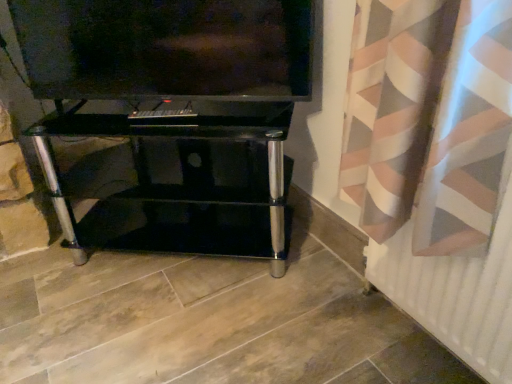
Question: Is black glass tv stand at center in front of white matte radiator at lower right?

Choices:
 (A) no
 (B) yes

Answer: (A)

Question: Does black glass tv stand at center come behind white matte radiator at lower right?

Choices:
 (A) no
 (B) yes

Answer: (B)

Question: From the image's perspective, would you say black glass tv stand at center is positioned over white matte radiator at lower right?

Choices:
 (A) yes
 (B) no

Answer: (A)

Question: Considering the relative sizes of black glass tv stand at center and white matte radiator at lower right in the image provided, is black glass tv stand at center thinner than white matte radiator at lower right?

Choices:
 (A) no
 (B) yes

Answer: (A)

Question: Is black glass tv stand at center aimed at white matte radiator at lower right?

Choices:
 (A) yes
 (B) no

Answer: (B)

Question: Is black glass tv stand at center far from white matte radiator at lower right?

Choices:
 (A) yes
 (B) no

Answer: (B)

Question: Is black glass tv stand at center in front of matte black tv at upper center?

Choices:
 (A) yes
 (B) no

Answer: (B)

Question: Considering the relative positions of black glass tv stand at center and matte black tv at upper center in the image provided, is black glass tv stand at center behind matte black tv at upper center?

Choices:
 (A) yes
 (B) no

Answer: (A)

Question: Can you confirm if black glass tv stand at center is bigger than matte black tv at upper center?

Choices:
 (A) yes
 (B) no

Answer: (A)

Question: From a real-world perspective, is black glass tv stand at center under matte black tv at upper center?

Choices:
 (A) yes
 (B) no

Answer: (A)

Question: Is black glass tv stand at center facing towards matte black tv at upper center?

Choices:
 (A) yes
 (B) no

Answer: (B)

Question: Would you say black glass tv stand at center is a long distance from matte black tv at upper center?

Choices:
 (A) yes
 (B) no

Answer: (B)

Question: Considering the relative positions of white matte radiator at lower right and black glass tv stand at center in the image provided, is white matte radiator at lower right to the left of black glass tv stand at center from the viewer's perspective?

Choices:
 (A) no
 (B) yes

Answer: (A)